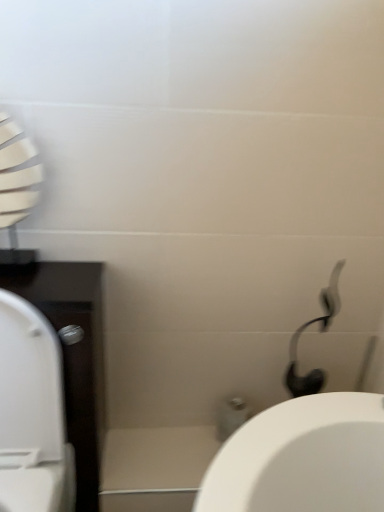
Identify the location of white glossy toilet at left. The image size is (384, 512). (32, 413).

Find the location of a particular element. Image resolution: width=384 pixels, height=512 pixels. white glossy porcelain at center is located at coordinates (155, 467).

At what (x,y) coordinates should I click in order to perform the action: click on white matte shower head at upper right. Please return your answer as a coordinate pair (x, y). This screenshot has height=512, width=384. Looking at the image, I should click on (322, 331).

Between white glossy porcelain at center and white matte shower head at upper right, which one appears on the left side from the viewer's perspective?

white glossy porcelain at center.

Does white glossy porcelain at center have a smaller size compared to white matte shower head at upper right?

Yes.

From the image's perspective, does white glossy porcelain at center appear lower than white matte shower head at upper right?

Yes, from the image's perspective, white glossy porcelain at center is below white matte shower head at upper right.

Is white glossy porcelain at center turned away from white matte shower head at upper right?

No, white glossy porcelain at center is not facing away from white matte shower head at upper right.

Measure the distance between white glossy toilet at left and white matte shower head at upper right.

70.40 centimeters.

Is white glossy toilet at left positioned beyond the bounds of white matte shower head at upper right?

That's correct, white glossy toilet at left is outside of white matte shower head at upper right.

From a real-world perspective, which object stands above the other?

In real-world perspective, white matte shower head at upper right is above.

Is white glossy porcelain at center completely or partially inside white glossy toilet at left?

Actually, white glossy porcelain at center is outside white glossy toilet at left.

Considering the relative positions of white glossy toilet at left and white glossy porcelain at center in the image provided, is white glossy toilet at left to the left or to the right of white glossy porcelain at center?

In the image, white glossy toilet at left appears on the left side of white glossy porcelain at center.

Locate an element on the screen. toilet that is in front of the white glossy porcelain at center is located at coordinates (32, 413).

Does point (183, 510) come behind point (49, 424)?

Yes, it is.

Is white glossy porcelain at center facing away from white glossy toilet at left?

That's not correct — white glossy porcelain at center is not looking away from white glossy toilet at left.

Can you confirm if white glossy porcelain at center is bigger than white glossy toilet at left?

No, white glossy porcelain at center is not bigger than white glossy toilet at left.

Which of these two, white glossy porcelain at center or white glossy toilet at left, is thinner?

white glossy porcelain at center is thinner.

From the image's perspective, which object appears higher, white matte shower head at upper right or white glossy porcelain at center?

white matte shower head at upper right appears higher in the image.

Which is closer to the camera, (327,295) or (111,461)?

The point (327,295) is more forward.

How many degrees apart are the facing directions of white matte shower head at upper right and white glossy porcelain at center?

1.13 degrees.

Is white matte shower head at upper right not close to white glossy porcelain at center?

No, white matte shower head at upper right is in close proximity to white glossy porcelain at center.

Are white matte shower head at upper right and white glossy toilet at left making contact?

No, white matte shower head at upper right is not next to white glossy toilet at left.

Which of these two, white matte shower head at upper right or white glossy toilet at left, is smaller?

white matte shower head at upper right.

Between point (298, 390) and point (24, 506), which one is positioned in front?

The point (24, 506) is closer.

Is white matte shower head at upper right thinner than white glossy toilet at left?

Correct, the width of white matte shower head at upper right is less than that of white glossy toilet at left.

This screenshot has height=512, width=384. In order to click on shower on the right of white glossy porcelain at center in this screenshot , I will do (x=322, y=331).

Where is `toilet in front of the white matte shower head at upper right`? Image resolution: width=384 pixels, height=512 pixels. toilet in front of the white matte shower head at upper right is located at coordinates (32, 413).

When comparing their distances from white glossy toilet at left, does white matte shower head at upper right or white glossy porcelain at center seem further?

white matte shower head at upper right lies further to white glossy toilet at left than the other object.

Considering their positions, is white glossy porcelain at center positioned further to white matte shower head at upper right than white glossy toilet at left?

Based on the image, white glossy toilet at left appears to be further to white matte shower head at upper right.

Estimate the real-world distances between objects in this image. Which object is further from white matte shower head at upper right, white glossy toilet at left or white glossy porcelain at center?

white glossy toilet at left.

Which object lies nearer to the anchor point white glossy toilet at left, white glossy porcelain at center or white matte shower head at upper right?

white glossy porcelain at center is positioned closer to the anchor white glossy toilet at left.

Looking at the image, which one is located further to white glossy porcelain at center, white glossy toilet at left or white matte shower head at upper right?

white matte shower head at upper right is further to white glossy porcelain at center.

Considering their positions, is white matte shower head at upper right positioned closer to white glossy porcelain at center than white glossy toilet at left?

white glossy toilet at left lies closer to white glossy porcelain at center than the other object.

Where is `shower between white glossy toilet at left and white glossy porcelain at center from front to back`? shower between white glossy toilet at left and white glossy porcelain at center from front to back is located at coordinates (322, 331).